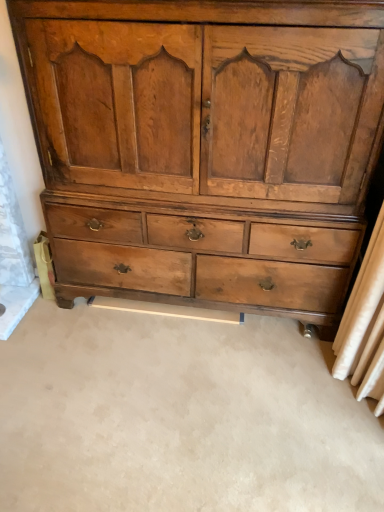
The height and width of the screenshot is (512, 384). What do you see at coordinates (204, 140) in the screenshot?
I see `shiny brown wood chest of drawers at center` at bounding box center [204, 140].

What is the approximate width of shiny brown wood chest of drawers at center?

shiny brown wood chest of drawers at center is 22.18 inches in width.

At what (x,y) coordinates should I click in order to perform the action: click on shiny brown wood chest of drawers at center. Please return your answer as a coordinate pair (x, y). This screenshot has width=384, height=512. Looking at the image, I should click on (204, 140).

Where is `shiny brown wood chest of drawers at center`? Image resolution: width=384 pixels, height=512 pixels. shiny brown wood chest of drawers at center is located at coordinates (204, 140).